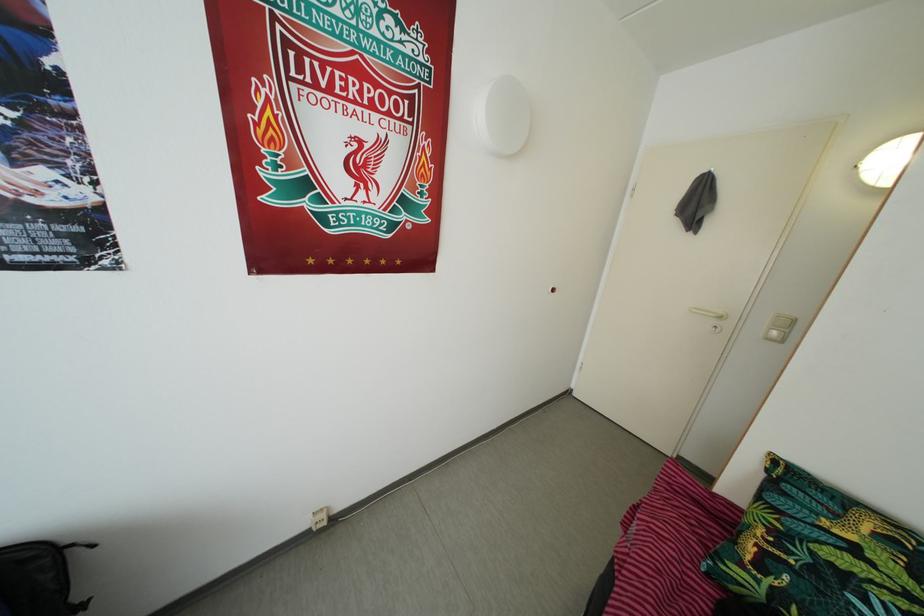
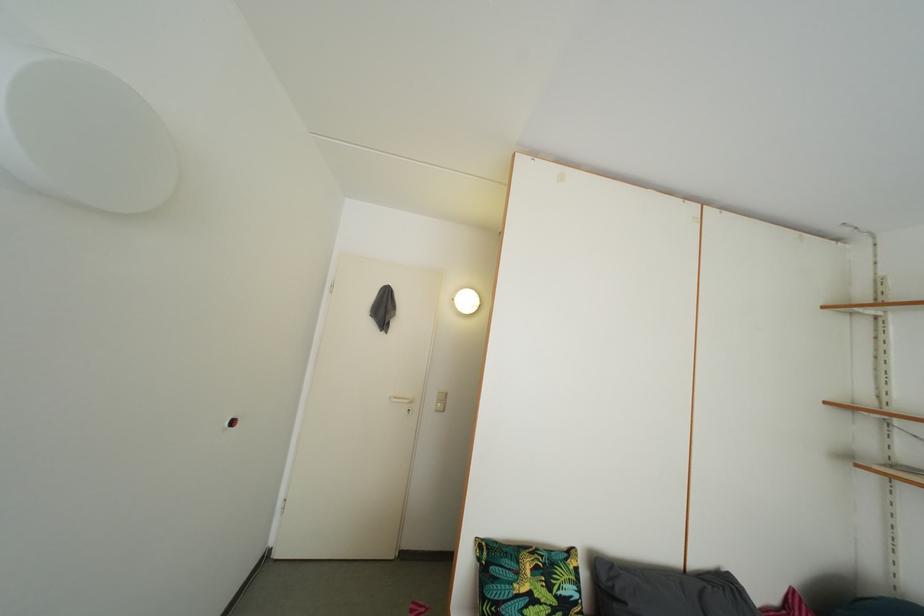
Question: Based on the continuous images, in which direction is the camera rotating? Reply with the corresponding letter.

Choices:
 (A) Left
 (B) Right
 (C) Up
 (D) Down

Answer: (B)